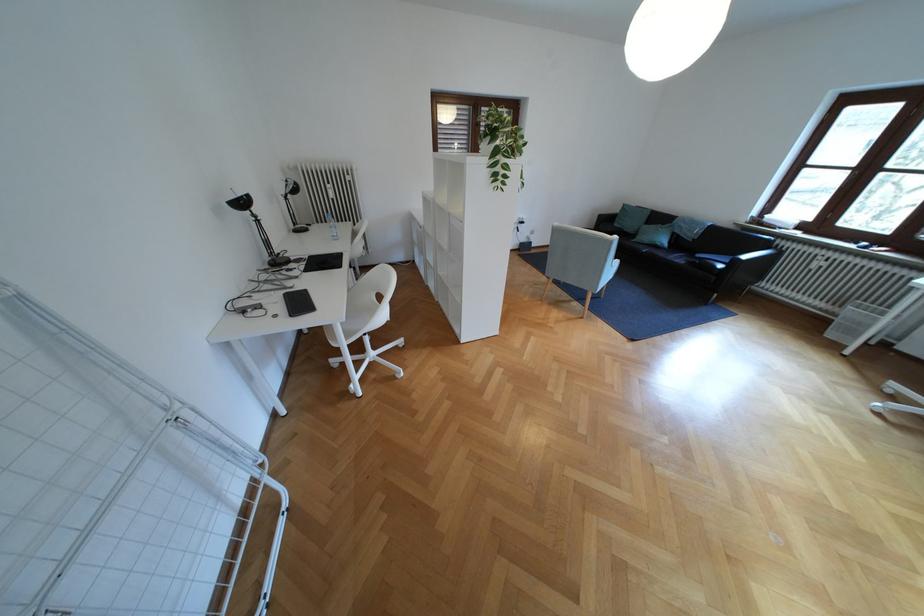
Locate an element on the screen. The width and height of the screenshot is (924, 616). black sofa armrest is located at coordinates point(761,256).